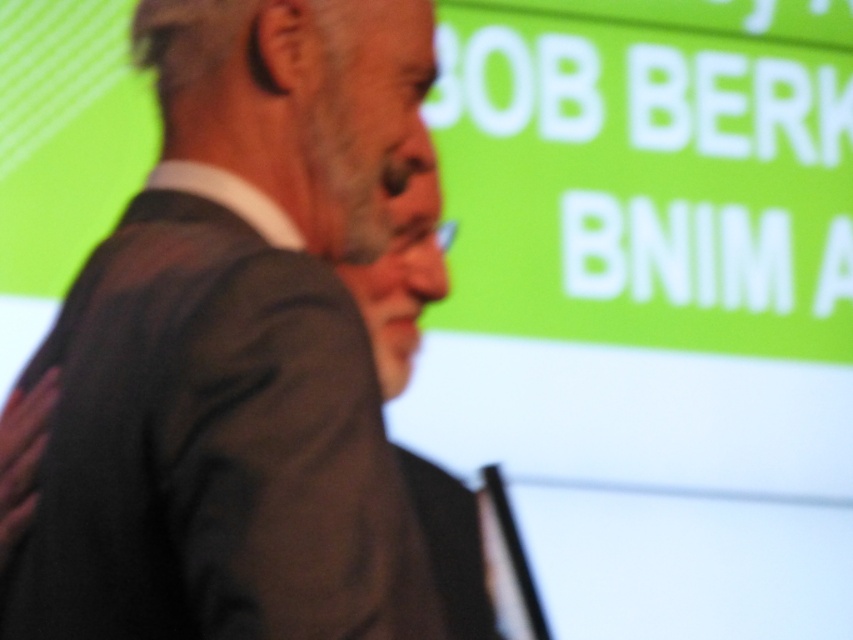
Describe the element at coordinates (236, 348) in the screenshot. I see `dark gray suit at center` at that location.

Between dark gray suit at center and matte black suit at center, which one appears on the left side from the viewer's perspective?

From the viewer's perspective, dark gray suit at center appears more on the left side.

Which is behind, point (219, 74) or point (381, 348)?

The point (381, 348) is behind.

Image resolution: width=853 pixels, height=640 pixels. I want to click on dark gray suit at center, so click(x=236, y=348).